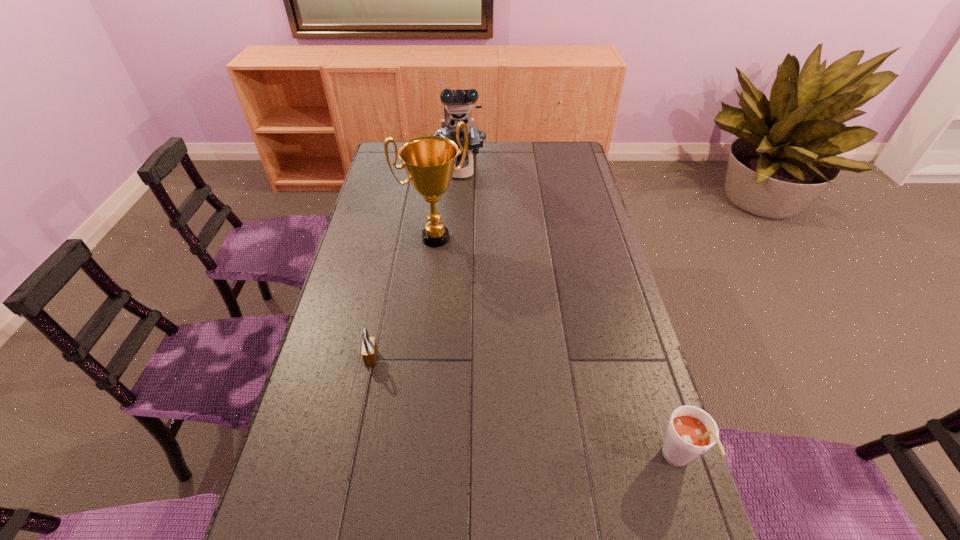
The height and width of the screenshot is (540, 960). What are the coordinates of `free point located through the eyepieces of the microscope` in the screenshot? It's located at (466, 258).

Locate an element on the screen. This screenshot has height=540, width=960. free spot located through the eyepieces of the microscope is located at coordinates (465, 246).

Where is `free space located 0.390m through the eyepieces of the microscope`? free space located 0.390m through the eyepieces of the microscope is located at coordinates (466, 260).

Where is `object that is at the far edge`? The width and height of the screenshot is (960, 540). object that is at the far edge is located at coordinates (457, 103).

The image size is (960, 540). In order to click on object located at the left edge in this screenshot , I will do `click(369, 353)`.

Identify the location of object that is at the right edge. (691, 431).

I want to click on free space at the far edge of the desktop, so click(x=478, y=159).

This screenshot has width=960, height=540. In order to click on vacant space at the left edge of the desktop in this screenshot , I will do `click(390, 184)`.

Image resolution: width=960 pixels, height=540 pixels. Find the location of `blank space at the right edge of the desktop`. blank space at the right edge of the desktop is located at coordinates (673, 473).

In the image, there is a desktop. Where is `vacant space at the far left corner`? This screenshot has width=960, height=540. vacant space at the far left corner is located at coordinates (376, 163).